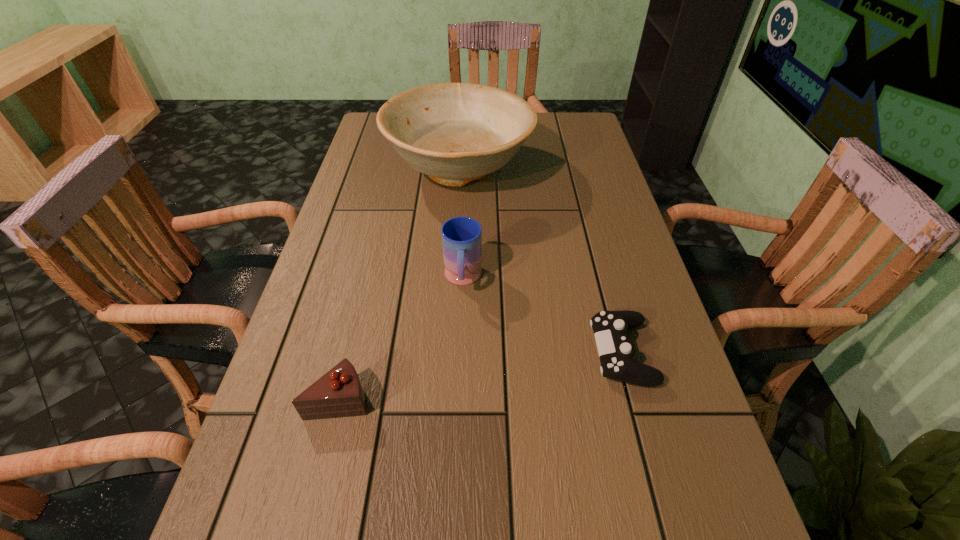
Locate an element on the screen. The height and width of the screenshot is (540, 960). the farthest object is located at coordinates (455, 133).

You are a GUI agent. You are given a task and a screenshot of the screen. Output one action in this format:
    pyautogui.click(x=<x>, y=<y>)
    Task: Click on the tallest object
    The height and width of the screenshot is (540, 960).
    Given the screenshot: What is the action you would take?
    pyautogui.click(x=455, y=133)

The image size is (960, 540). Find the location of `the fourth nearest object`. the fourth nearest object is located at coordinates (461, 236).

Identify the location of the second tallest object. The height and width of the screenshot is (540, 960). (461, 236).

The image size is (960, 540). In order to click on the third tallest object in this screenshot , I will do `click(338, 393)`.

What are the coordinates of `the taller chocolate cake` in the screenshot? It's located at (338, 393).

You are a GUI agent. You are given a task and a screenshot of the screen. Output one action in this format:
    pyautogui.click(x=<x>, y=<y>)
    Task: Click on the fourth tallest object
    The image size is (960, 540).
    Given the screenshot: What is the action you would take?
    coord(610,328)

Identify the location of control. The height and width of the screenshot is (540, 960). (610, 328).

This screenshot has width=960, height=540. Identify the location of free space located on the front of the tallest object. (452, 300).

Find the location of `free space located 0.150m on the side of the second farthest object with the handle`. free space located 0.150m on the side of the second farthest object with the handle is located at coordinates (460, 358).